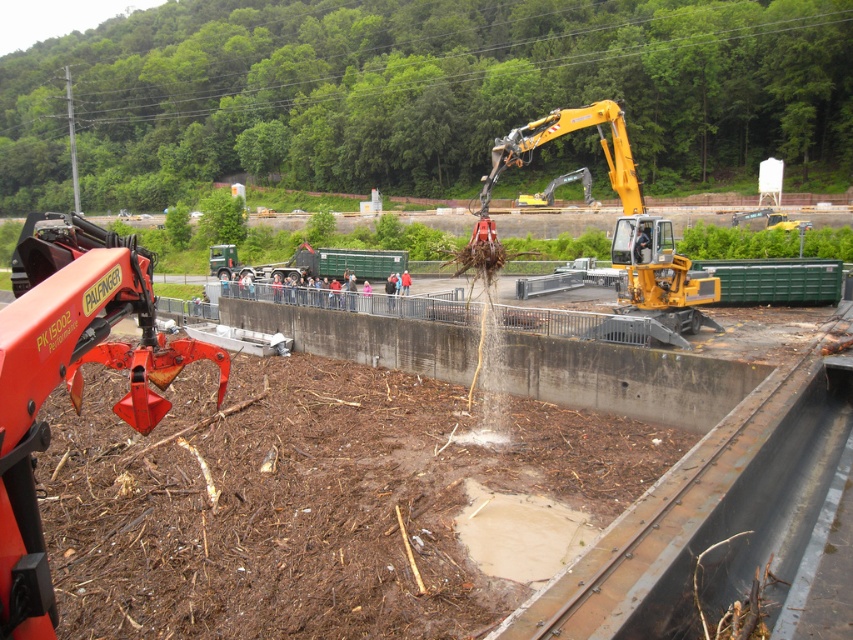
You are a construction worker tasked with moving the yellow metallic excavator at center to a new location. The path you need to take is currently covered by the brown mulch at center. Can the excavator move through the mulch area without getting stuck, considering the mulch coverage?

The brown mulch at center has a larger width than the yellow metallic excavator at center, so the excavator can move through the mulch area without getting stuck as there is enough space.

You are a construction worker who needs to place a new safety barrier. You have two options for placement based on the objects in the scene. The first option is to place it on the brown mulch at center, and the second is on the orange metallic claw at lower left. Which location would provide a more stable base for the barrier?

The brown mulch at center is bigger than the orange metallic claw at lower left, so placing the safety barrier on the brown mulch at center would provide a more stable base since it has a larger surface area to support the barrier.